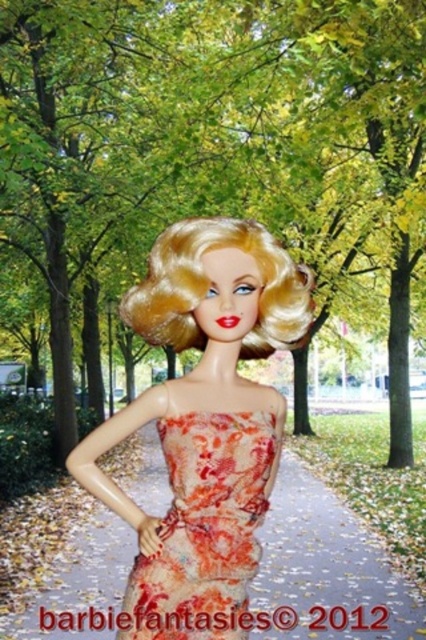
Who is more forward, (131,500) or (190,436)?

Point (190,436) is in front.

Is point (265, 432) behind point (210, 419)?

Yes.

Where is `shiny plastic doll at center`? This screenshot has width=426, height=640. shiny plastic doll at center is located at coordinates (204, 422).

Consider the image. Who is positioned more to the left, shiny plastic doll at center or matte plastic pavement at center?

Positioned to the left is shiny plastic doll at center.

Which is more to the right, shiny plastic doll at center or matte plastic pavement at center?

Positioned to the right is matte plastic pavement at center.

Is point (236, 234) closer to camera compared to point (253, 602)?

Yes, point (236, 234) is closer to viewer.

Where is `shiny plastic doll at center`? shiny plastic doll at center is located at coordinates (204, 422).

Who is shorter, matte plastic pavement at center or floral-patterned fabric dress at center?

floral-patterned fabric dress at center

Which of these two, matte plastic pavement at center or floral-patterned fabric dress at center, stands taller?

matte plastic pavement at center

You are a GUI agent. You are given a task and a screenshot of the screen. Output one action in this format:
    pyautogui.click(x=<x>, y=<y>)
    Task: Click on the matte plastic pavement at center
    The height and width of the screenshot is (640, 426).
    Given the screenshot: What is the action you would take?
    (x=327, y=563)